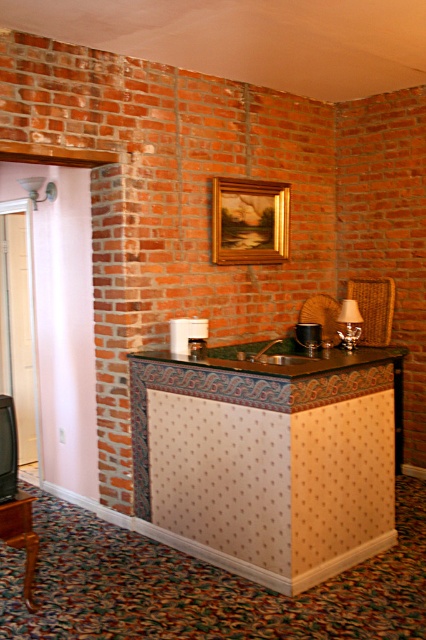
Question: Considering the real-world distances, which object is farthest from the matte gold lampshade at upper center?

Choices:
 (A) gold wooden picture frame at upper center
 (B) woven wicker armchair at center
 (C) matte gold lamp at center
 (D) wooden stool at lower left

Answer: (B)

Question: Which point appears closest to the camera in this image?

Choices:
 (A) (29, 589)
 (B) (28, 192)
 (C) (344, 314)

Answer: (A)

Question: Does gold wooden picture frame at upper center appear on the left side of woven wicker armchair at center?

Choices:
 (A) no
 (B) yes

Answer: (B)

Question: Is wicker armchair at center positioned behind matte gold lamp at center?

Choices:
 (A) yes
 (B) no

Answer: (A)

Question: Does wooden stool at lower left come in front of wicker armchair at center?

Choices:
 (A) yes
 (B) no

Answer: (A)

Question: Which point is farther to the camera?

Choices:
 (A) gold wooden picture frame at upper center
 (B) wooden stool at lower left

Answer: (A)